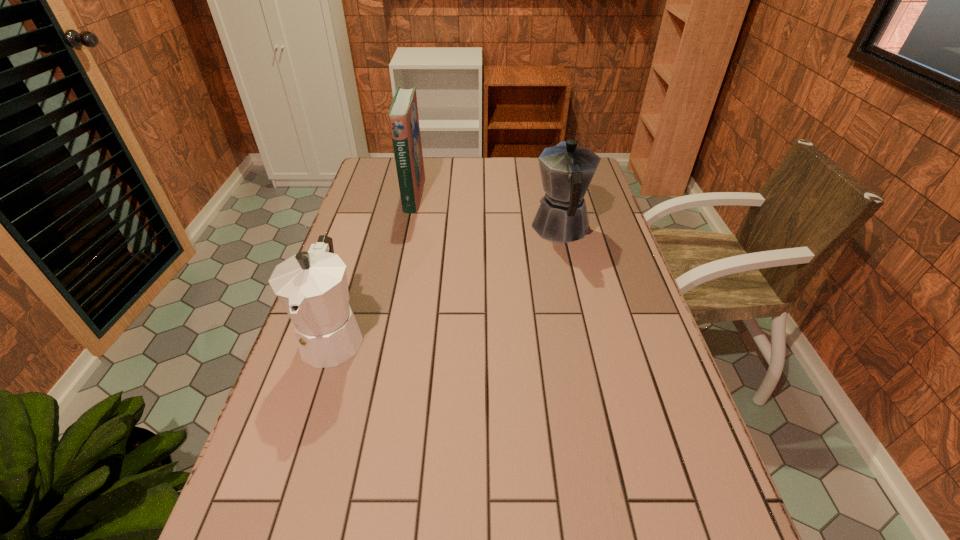
Where is `free location that satisfies the following two spatial constraints: 1. on the cover of the second object from right to left; 2. at the spout of the right coffeepot`? The width and height of the screenshot is (960, 540). free location that satisfies the following two spatial constraints: 1. on the cover of the second object from right to left; 2. at the spout of the right coffeepot is located at coordinates (406, 228).

What are the coordinates of `free space that satisfies the following two spatial constraints: 1. at the spout of the farther coffeepot; 2. on the cover of the second object from right to left` in the screenshot? It's located at (553, 194).